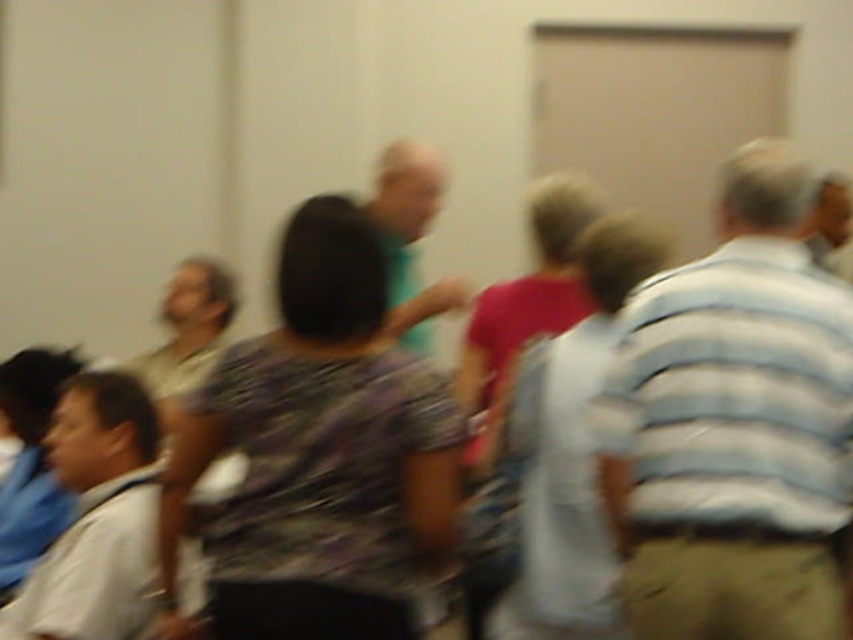
Question: Which point is closer to the camera?

Choices:
 (A) black matte shirt at center
 (B) light gray shirt at lower left

Answer: (B)

Question: Does khaki pants at right appear on the right side of black matte shirt at center?

Choices:
 (A) yes
 (B) no

Answer: (A)

Question: In this image, where is khaki pants at right located relative to light gray shirt at lower left?

Choices:
 (A) below
 (B) above

Answer: (B)

Question: Which point is farther to the camera?

Choices:
 (A) black matte shirt at center
 (B) light gray shirt at lower left
 (C) khaki pants at right

Answer: (A)

Question: Which is nearer to the khaki pants at right?

Choices:
 (A) black matte shirt at center
 (B) light gray shirt at lower left

Answer: (B)

Question: Can you confirm if khaki pants at right is smaller than light gray shirt at lower left?

Choices:
 (A) no
 (B) yes

Answer: (A)